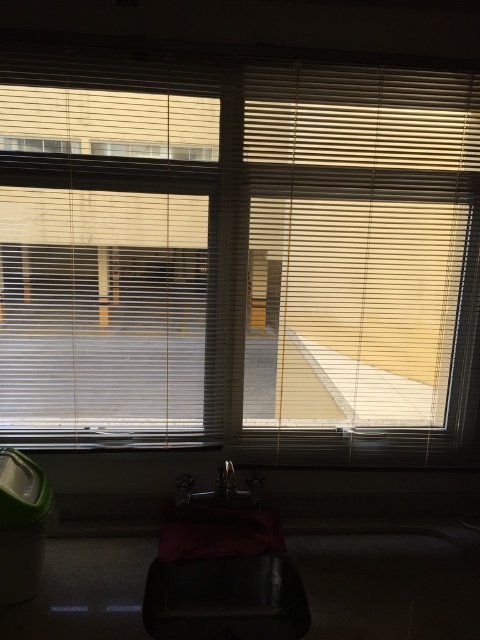
You are standing in the kitchen and want to place a small object between the two points labeled as point (132, 122) and point (38, 148). Which point is closer to you so you can place the object there first?

Point (132, 122) is closer to you than point (38, 148) because it is further to the viewer, so you should place the object near point (132, 122) first.

You are a delivery robot with a height of 1.5 meters. You need to pass through a narrow corridor leading to the kitchen entrance. The corridor has a low hanging matte white blinds at left. Will your height allow you to pass through without hitting the blinds?

The matte white blinds at left are 1.44 meters away from the viewer, so the robot is 1.5 meters tall, which is taller than the distance. Therefore, the robot may hit the blinds when passing through.

You are trying to determine if the matte plastic blinds at center can cover the transparent plastic window at upper center completely. Based on their sizes, is this possible?

The matte plastic blinds at center might be wider than transparent plastic window at upper center, so it is possible that they can cover it completely.